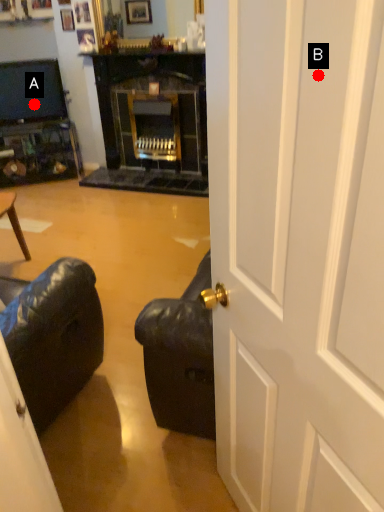
Question: Two points are circled on the image, labeled by A and B beside each circle. Which point is farther from the camera taking this photo?

Choices:
 (A) A is further
 (B) B is further

Answer: (A)